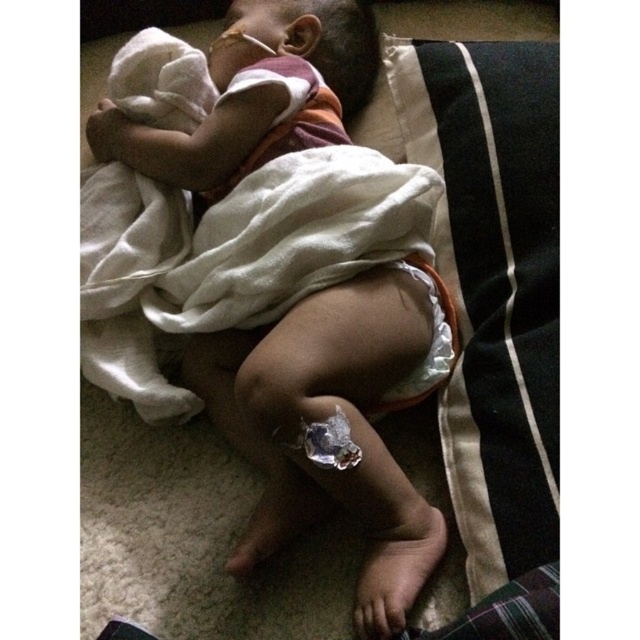
You are a caregiver checking on a sleeping child. You notice the orange diaper at center and the black fabric pillow at center. Which item is wider?

The orange diaper at center is wider than the black fabric pillow at center.

You are a parent trying to adjust the blanket of the sleeping child. The orange diaper at center and the black fabric pillow at center are both at the center of the image. How far apart are these two items?

The orange diaper at center and the black fabric pillow at center are 6.66 inches apart.

You are a parent trying to place a baby monitor on a nightstand that is 26 inches away from where you are standing. You see the black fabric pillow at center in the scene. Can you tell me if the nightstand is closer to you than the pillow?

The black fabric pillow at center is 27.12 inches away from the viewer. Since the nightstand is 26 inches away, the nightstand is closer to you than the pillow.